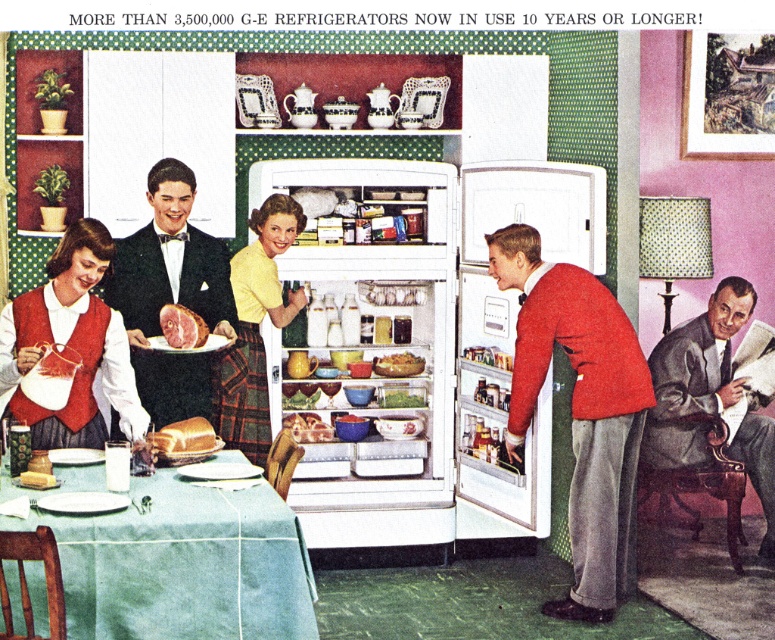
You are organizing a picnic and need to decide which item can cover more surface area between the green fabric tablecloth at lower left and the matte red vest at lower left. Which item would you choose?

The green fabric tablecloth at lower left is larger in size than the matte red vest at lower left, so it can cover more surface area and is the better choice for the picnic.

Looking at this image, you are arranging a photo album and need to place the wooden framed picture at upper right and the green matte bowl at center in a row. Which object should you place first if you want the taller one to be on the left side?

You should place the wooden framed picture at upper right first on the left side since it is much taller than the green matte bowl at center.